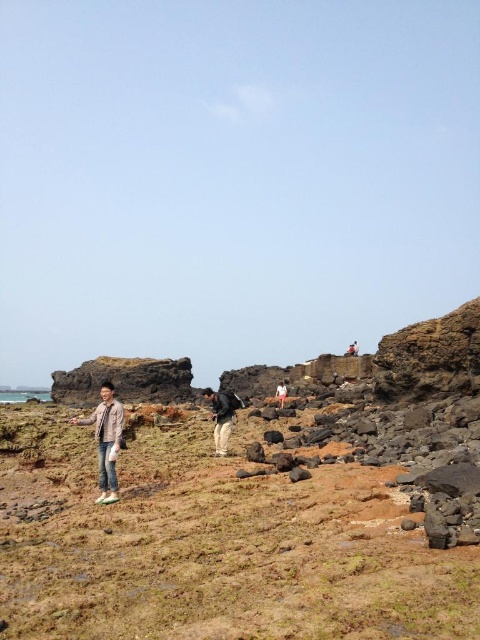
Does light brown leather jacket at center have a lesser height compared to matte black backpack at center?

Yes.

Is light brown leather jacket at center thinner than matte black backpack at center?

In fact, light brown leather jacket at center might be wider than matte black backpack at center.

Based on the photo, who is more forward, (97, 406) or (218, 412)?

Point (97, 406)

You are a GUI agent. You are given a task and a screenshot of the screen. Output one action in this format:
    pyautogui.click(x=<x>, y=<y>)
    Task: Click on the light brown leather jacket at center
    
    Given the screenshot: What is the action you would take?
    pyautogui.click(x=106, y=440)

Does brown grassy terrain at lower left have a greater height compared to light brown leather jacket at center?

No.

Looking at this image, which is more to the left, brown grassy terrain at lower left or light brown leather jacket at center?

Positioned to the left is light brown leather jacket at center.

Is point (48, 540) in front of point (101, 387)?

Yes, point (48, 540) is closer to viewer.

Where is `brown grassy terrain at lower left`? This screenshot has width=480, height=640. brown grassy terrain at lower left is located at coordinates coord(213,545).

Is light brown leather jacket at center positioned at the back of pink fabric at center?

No, light brown leather jacket at center is closer to the viewer.

Which of these two, light brown leather jacket at center or pink fabric at center, stands taller?

light brown leather jacket at center

Locate an element on the screen. light brown leather jacket at center is located at coordinates (106, 440).